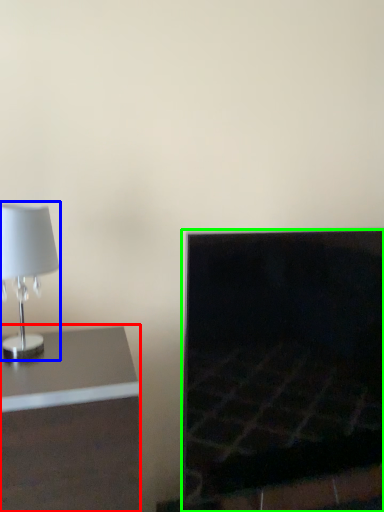
Question: Estimate the real-world distances between objects in this image. Which object is farther from furniture (highlighted by a red box), lamp (highlighted by a blue box) or fireplace (highlighted by a green box)?

Choices:
 (A) lamp
 (B) fireplace

Answer: (B)